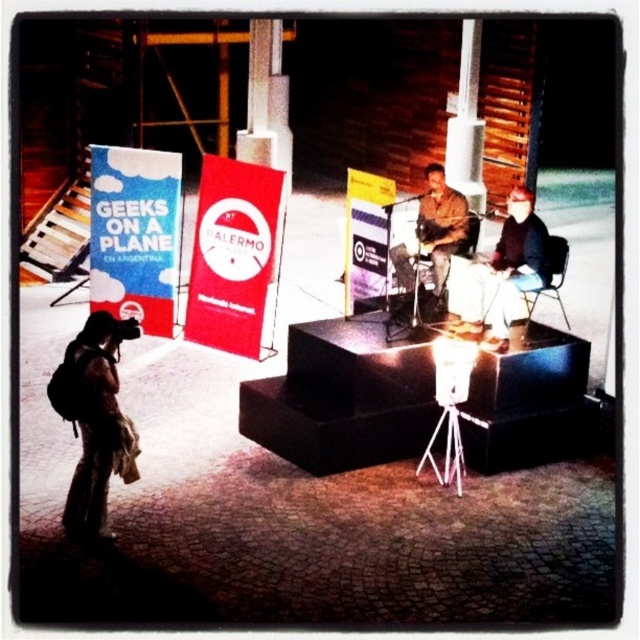
Looking at this image, you are a photographer at the event and want to capture a clear shot of the leather jacket at center without the brown backpack at lower left blocking the view. Which object should you move closer to, and which should you move away from?

To avoid the brown backpack at lower left blocking the leather jacket at center, you should move closer to the leather jacket at center and move away from the brown backpack at lower left since the backpack is positioned below the jacket.